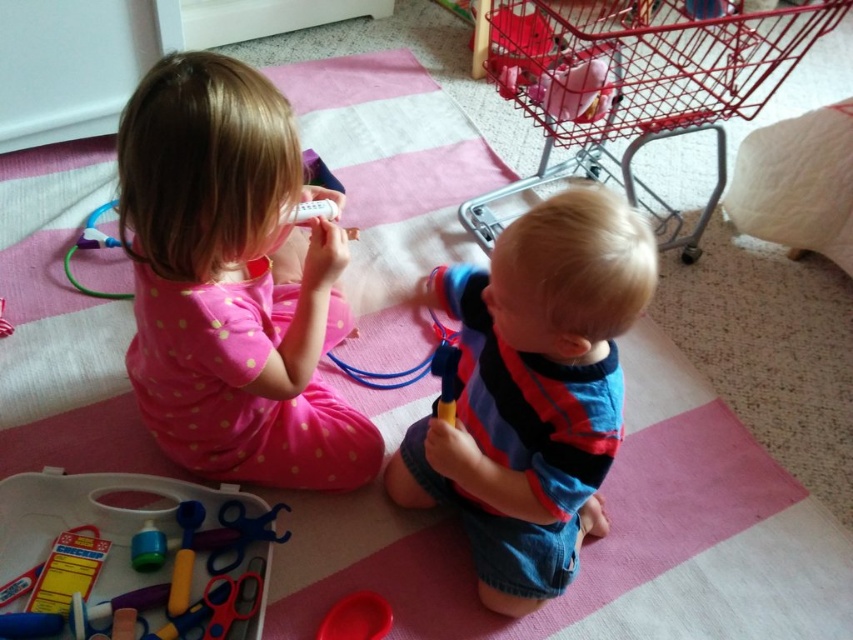
You are a parent trying to put your child to bed. You see the pink polka dot pajamas at upper left in the playroom. Can you reach them from where you are standing?

The pink polka dot pajamas at upper left and viewer are 33.56 inches apart, so yes, you can reach them as the distance is within a comfortable arm length.

You are organizing a toy store and need to place the red wire shopping cart at upper right and the rubber red bowl at lower center on a shelf. If the shelf can only hold items that are narrower than 12 inches, which toy can safely be placed on the shelf?

The rubber red bowl at lower center can safely be placed on the shelf because its width is narrower than the red wire shopping cart at upper right, and if the shelf requires items under 12 inches, the bowl likely fits while the cart may exceed the limit.

Looking at this image, you are standing at the origin point in a playroom. There are two points marked in the scene. The first point is at coordinates point (621, 42) and the second is at point (329, 625). If you want to move towards the point that is further away from you, which coordinate should you head towards?

Point (621, 42) is behind point (329, 625), so you should head towards point (621, 42) as it is further away from the origin.